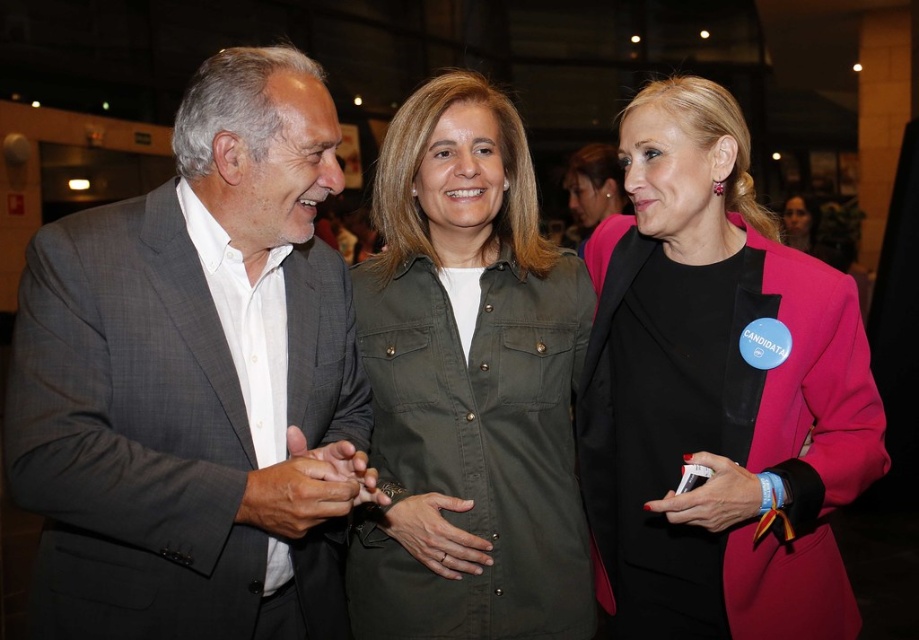
Question: Is gray suit at left wider than pink matte blazer at center?

Choices:
 (A) yes
 (B) no

Answer: (B)

Question: Which point appears closest to the camera in this image?

Choices:
 (A) coord(219,486)
 (B) coord(543,627)

Answer: (A)

Question: Can you confirm if gray suit at left is positioned to the left of green matte shirt at center?

Choices:
 (A) no
 (B) yes

Answer: (B)

Question: Based on their relative distances, which object is nearer to the green matte shirt at center?

Choices:
 (A) pink matte blazer at center
 (B) gray suit at left

Answer: (A)

Question: Among these objects, which one is farthest from the camera?

Choices:
 (A) gray suit at left
 (B) pink matte blazer at center

Answer: (B)

Question: In this image, where is gray suit at left located relative to pink matte blazer at center?

Choices:
 (A) right
 (B) left

Answer: (B)